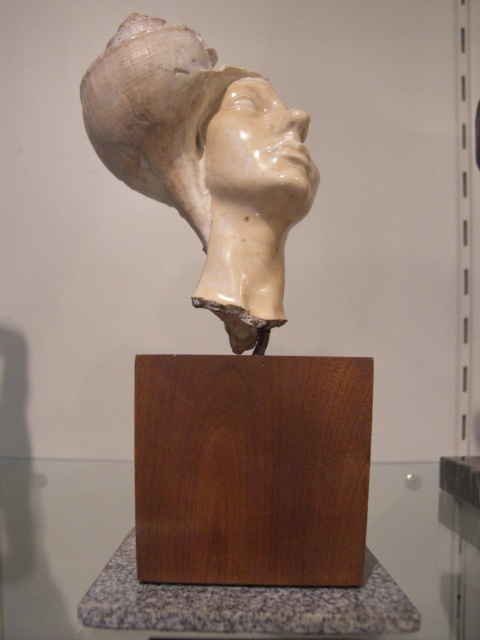
Between white porcelain sculpture at center and white glossy sculpture at center, which one appears on the left side from the viewer's perspective?

white porcelain sculpture at center

Does white porcelain sculpture at center have a greater width compared to white glossy sculpture at center?

Yes, white porcelain sculpture at center is wider than white glossy sculpture at center.

Is point (144, 404) farther from viewer compared to point (255, 211)?

No, (144, 404) is in front of (255, 211).

Find the location of `white porcelain sculpture at center`. white porcelain sculpture at center is located at coordinates (230, 330).

Which of these two, dark brown wood at center or white glossy sculpture at center, stands taller?

white glossy sculpture at center

Is point (338, 509) less distant than point (177, 72)?

Yes, point (338, 509) is in front of point (177, 72).

This screenshot has width=480, height=640. What are the coordinates of `dark brown wood at center` in the screenshot? It's located at (252, 468).

Which is in front, point (310, 566) or point (275, 157)?

Point (310, 566)

What are the coordinates of `white porcelain sculpture at center` in the screenshot? It's located at (230, 330).

Where is `white porcelain sculpture at center`? This screenshot has height=640, width=480. white porcelain sculpture at center is located at coordinates (230, 330).